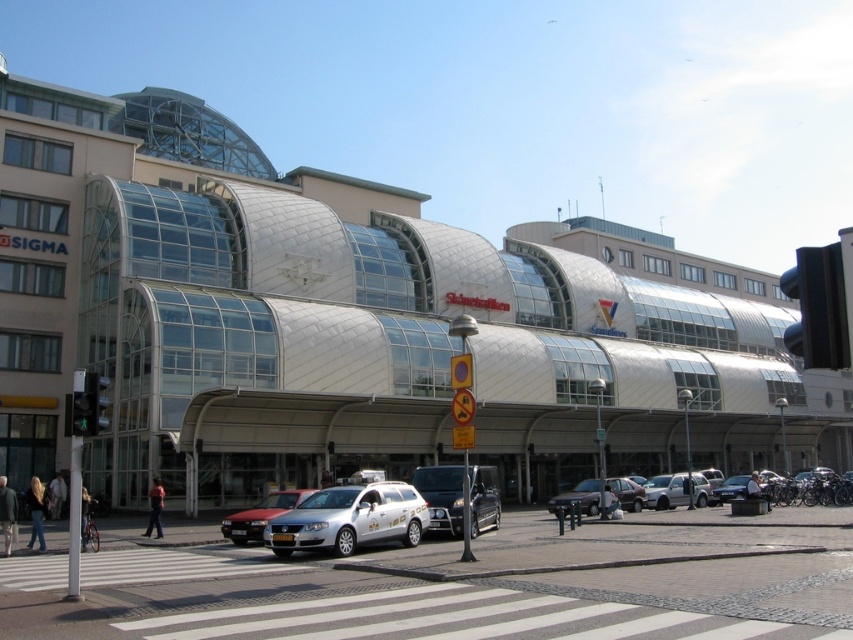
You are standing at the entrance of the transportation hub and looking towards the pedestrian crossing. There are two points marked on the pavement in front of you at coordinates point [587,502] and point [653,502]. Which point is closer to your current position?

Point [587,502] is closer to the viewer than point [653,502], so the point at [587,502] is closer to your current position.

You are a pedestrian standing at the pedestrian crossing in front of the transportation hub. You notice two vehicles nearby. Which one is closer to you between the silver metallic station wagon at center and the satin silver suv at lower right?

The silver metallic station wagon at center is closer to the viewer than the satin silver suv at lower right.